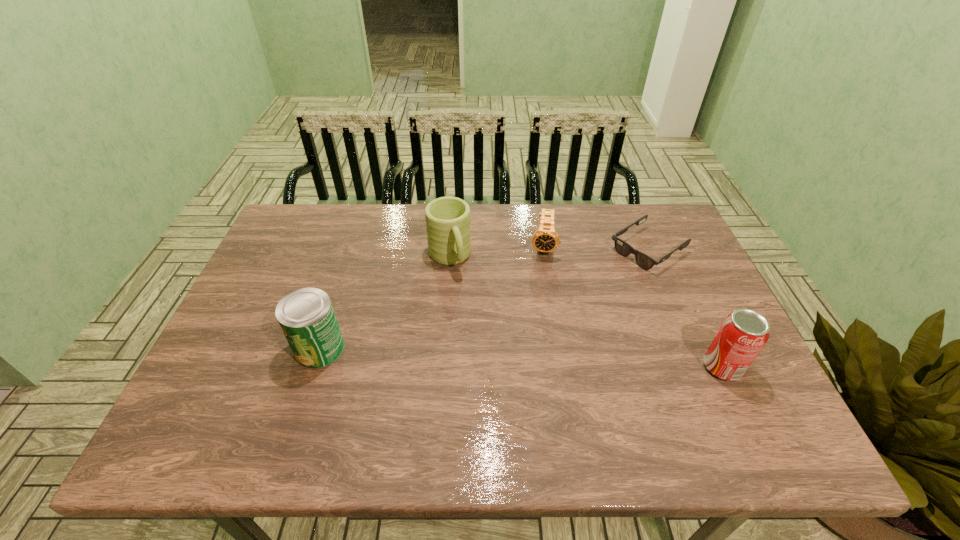
In order to click on vacant space on the desktop that is between the leftmost object and the soda can and is positioned on the side of the mug with the handle in this screenshot , I will do `click(494, 356)`.

I want to click on vacant space on the desktop that is between the leftmost object and the soda can and is positioned on the temples of the sunglasses, so click(x=486, y=356).

Identify the location of free space on the desktop that is between the leftmost object and the soda can and is positioned on the face of the third object from left to right. (536, 358).